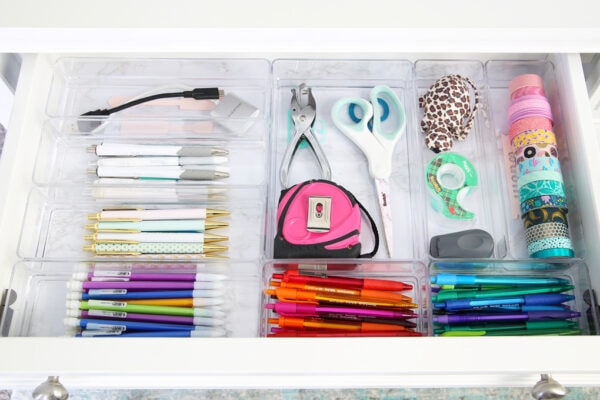
Where is `compartments`? compartments is located at coordinates tap(346, 169), tap(487, 198), tap(512, 198), tap(578, 290), tap(414, 293), tap(243, 302), tap(246, 227), tap(241, 164), tap(96, 92).